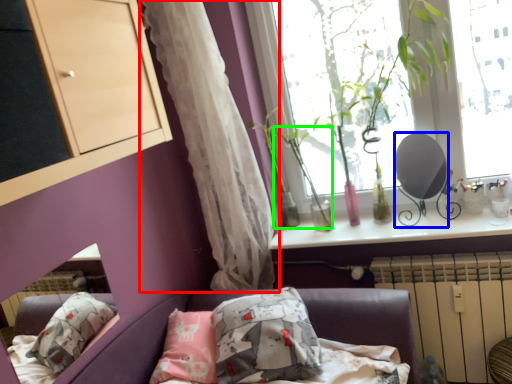
Question: Based on their relative distances, which object is nearer to curtain (highlighted by a red box)? Choose from mirror (highlighted by a blue box) and plant (highlighted by a green box).

Choices:
 (A) mirror
 (B) plant

Answer: (B)